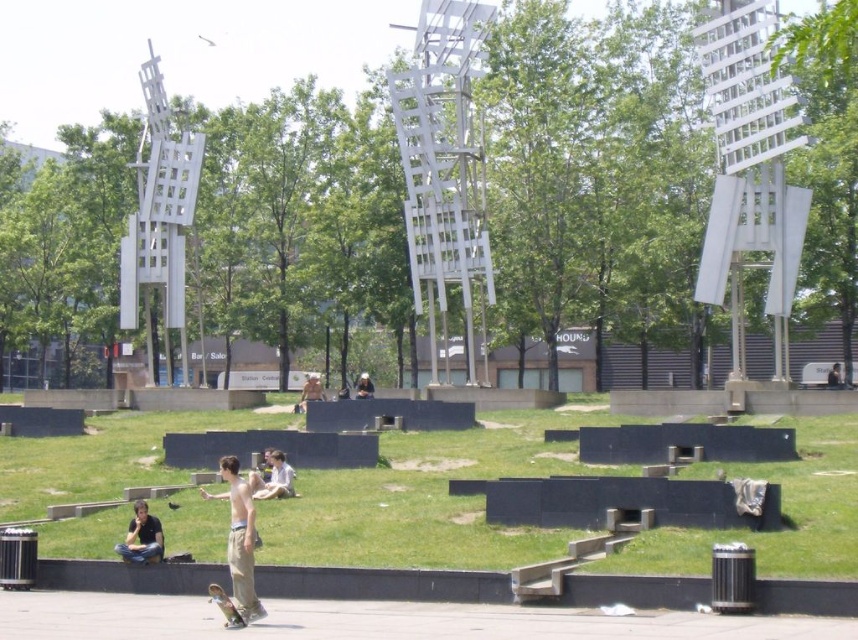
You are a photographer planning to capture a photo of the green grass at lower center and the dark hair person at center. Based on the scene description, which object is higher in the image?

The green grass at lower center is taller than the dark hair person at center, so the green grass at lower center appears higher in the image.

You are a photographer planning to take a photo of the wooden skateboard at lower left and the light blue shirt at center. Since you want both subjects to appear balanced in the frame, which object should you position closer to the camera to compensate for their size difference?

The wooden skateboard at lower left is taller than the light blue shirt at center. To balance their sizes in the photo, position the light blue shirt at center closer to the camera so it appears larger, matching the wooden skateboard at lower left in the frame.

You are standing in the park and see the wooden skateboard at lower left and the light blue shirt at center. Which object is closer to you?

The wooden skateboard at lower left is closer to you because it is positioned over the light blue shirt at center, indicating it is in front.